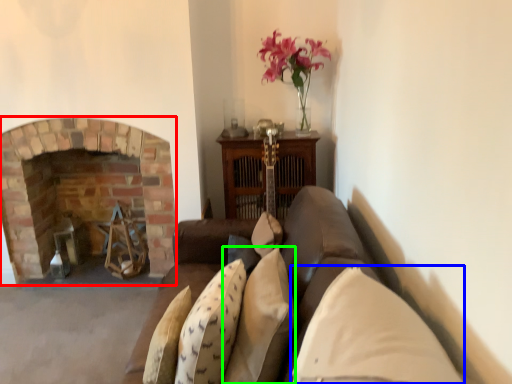
Question: Which is farther away from fireplace (highlighted by a red box)? pillow (highlighted by a blue box) or pillow (highlighted by a green box)?

Choices:
 (A) pillow
 (B) pillow

Answer: (A)